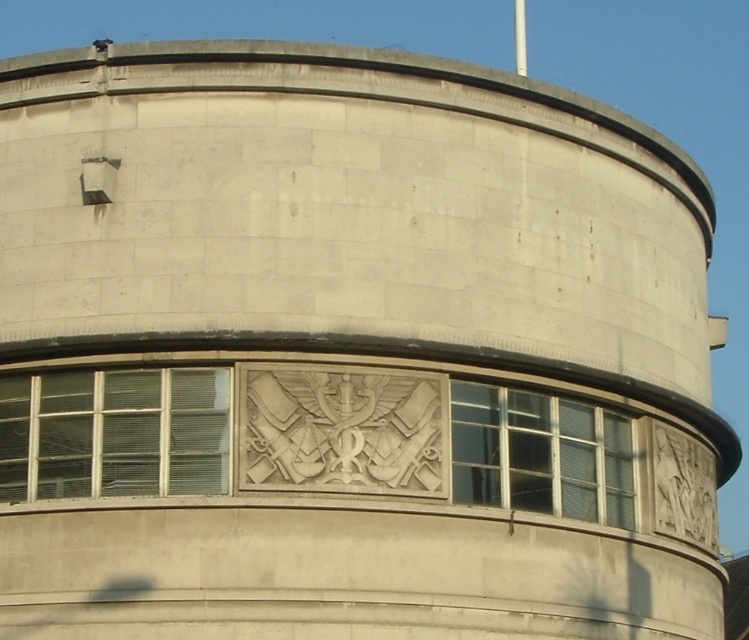
Can you confirm if clear glass window at lower left is positioned above clear glass window at center?

Yes, clear glass window at lower left is above clear glass window at center.

Does point (139, 456) come in front of point (479, 483)?

Yes, it is in front of point (479, 483).

Image resolution: width=749 pixels, height=640 pixels. Find the location of `clear glass window at lower left`. clear glass window at lower left is located at coordinates (115, 433).